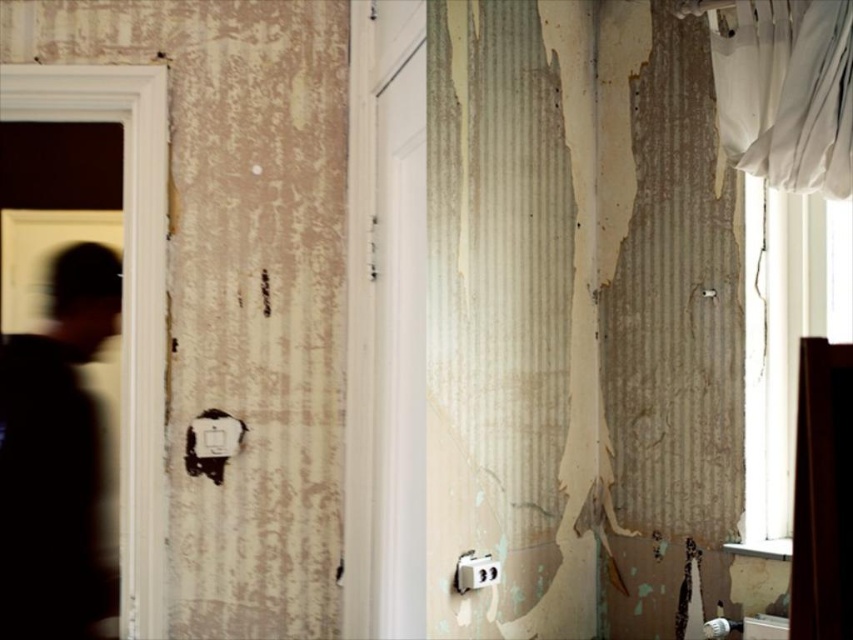
You are standing in front of the wall undergoing renovation. You notice the black matte person at left and the white fabric curtain at upper right. Which object appears larger in the image?

The white fabric curtain at upper right appears larger than the black matte person at left.

You are a delivery person with a box that is 1.5 meters wide. You need to move through the space between the black matte person at left and the white fabric curtain at upper right. Can you fit through the space without tilting the box?

The distance between the black matte person at left and the white fabric curtain at upper right is 1.31 meters. Since your box is 1.5 meters wide, it is wider than the available space. Therefore, you cannot fit through the space without tilting the box.